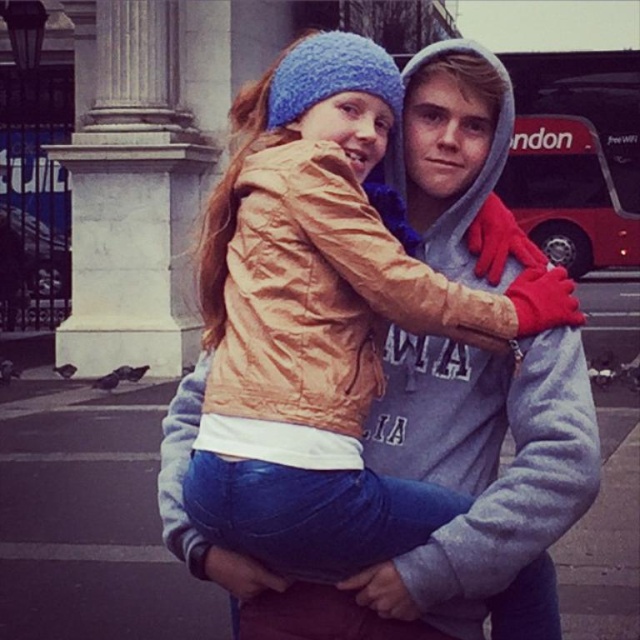
You are standing in the public space shown in the image and want to take a photo of the matte orange jacket at center without including the white marble pillar at upper left in the frame. Based on their positions, is this possible?

Yes, since the white marble pillar at upper left is to the left of the matte orange jacket at center, you can position yourself to the right side of the jacket to exclude the pillar from the frame.